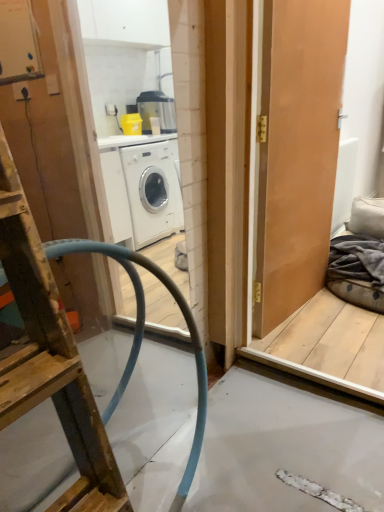
Question: Considering the relative sizes of matte wooden door at right and dark grey fabric at right in the image provided, is matte wooden door at right smaller than dark grey fabric at right?

Choices:
 (A) no
 (B) yes

Answer: (A)

Question: Considering the relative sizes of matte wooden door at right and dark grey fabric at right in the image provided, is matte wooden door at right thinner than dark grey fabric at right?

Choices:
 (A) no
 (B) yes

Answer: (B)

Question: Does matte wooden door at right appear on the left side of dark grey fabric at right?

Choices:
 (A) yes
 (B) no

Answer: (A)

Question: Is matte wooden door at right in front of dark grey fabric at right?

Choices:
 (A) yes
 (B) no

Answer: (A)

Question: Does matte wooden door at right have a greater height compared to dark grey fabric at right?

Choices:
 (A) no
 (B) yes

Answer: (B)

Question: From the image's perspective, is matte wooden door at right on dark grey fabric at right?

Choices:
 (A) no
 (B) yes

Answer: (B)

Question: Can you confirm if dark grey fabric at right is wider than wooden ladder at left?

Choices:
 (A) yes
 (B) no

Answer: (A)

Question: Is dark grey fabric at right far from wooden ladder at left?

Choices:
 (A) yes
 (B) no

Answer: (A)

Question: Is dark grey fabric at right positioned with its back to wooden ladder at left?

Choices:
 (A) no
 (B) yes

Answer: (A)

Question: Is the position of dark grey fabric at right less distant than that of wooden ladder at left?

Choices:
 (A) yes
 (B) no

Answer: (B)

Question: Does dark grey fabric at right come behind wooden ladder at left?

Choices:
 (A) no
 (B) yes

Answer: (B)

Question: From the image's perspective, is dark grey fabric at right above wooden ladder at left?

Choices:
 (A) no
 (B) yes

Answer: (B)

Question: Does matte wooden door at right lie behind wooden ladder at left?

Choices:
 (A) yes
 (B) no

Answer: (A)